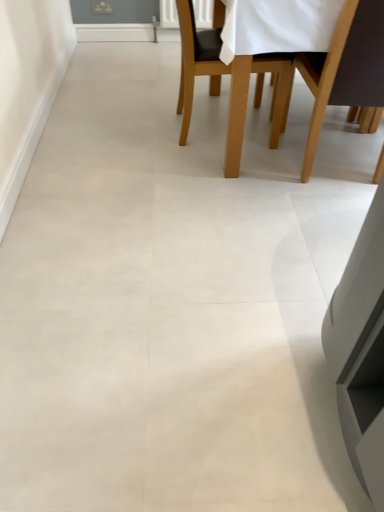
Question: Which direction should I rotate to face light brown wooden chair at upper center, acting as the 2th chair starting from the right, — up or down?

Choices:
 (A) down
 (B) up

Answer: (B)

Question: Does light brown wooden chair at upper center, acting as the 2th chair starting from the right, have a lesser height compared to brown wood chair at upper right, acting as the second chair starting from the left?

Choices:
 (A) yes
 (B) no

Answer: (A)

Question: Can you confirm if light brown wooden chair at upper center, which appears as the 1th chair when viewed from the left, is positioned to the left of brown wood chair at upper right, the first chair positioned from the right?

Choices:
 (A) no
 (B) yes

Answer: (B)

Question: From the image's perspective, does light brown wooden chair at upper center, acting as the 2th chair starting from the right, appear higher than brown wood chair at upper right, acting as the second chair starting from the left?

Choices:
 (A) no
 (B) yes

Answer: (B)

Question: Can you confirm if light brown wooden chair at upper center, acting as the 2th chair starting from the right, is bigger than brown wood chair at upper right, acting as the second chair starting from the left?

Choices:
 (A) yes
 (B) no

Answer: (A)

Question: Considering the relative sizes of light brown wooden chair at upper center, acting as the 2th chair starting from the right, and brown wood chair at upper right, the first chair positioned from the right, in the image provided, is light brown wooden chair at upper center, acting as the 2th chair starting from the right, wider than brown wood chair at upper right, the first chair positioned from the right,?

Choices:
 (A) no
 (B) yes

Answer: (B)

Question: Is light brown wooden chair at upper center, which appears as the 1th chair when viewed from the left, in contact with brown wood chair at upper right, the first chair positioned from the right?

Choices:
 (A) no
 (B) yes

Answer: (A)

Question: Is the depth of brown wood chair at upper right, acting as the second chair starting from the left, greater than that of light brown wooden chair at upper center, which appears as the 1th chair when viewed from the left?

Choices:
 (A) no
 (B) yes

Answer: (A)

Question: Are brown wood chair at upper right, the first chair positioned from the right, and light brown wooden chair at upper center, acting as the 2th chair starting from the right, located far from each other?

Choices:
 (A) no
 (B) yes

Answer: (A)

Question: Is brown wood chair at upper right, the first chair positioned from the right, thinner than light brown wooden chair at upper center, acting as the 2th chair starting from the right?

Choices:
 (A) no
 (B) yes

Answer: (B)

Question: Is brown wood chair at upper right, the first chair positioned from the right, at the left side of light brown wooden chair at upper center, which appears as the 1th chair when viewed from the left?

Choices:
 (A) yes
 (B) no

Answer: (B)

Question: Considering the relative sizes of brown wood chair at upper right, acting as the second chair starting from the left, and light brown wooden chair at upper center, which appears as the 1th chair when viewed from the left, in the image provided, is brown wood chair at upper right, acting as the second chair starting from the left, smaller than light brown wooden chair at upper center, which appears as the 1th chair when viewed from the left,?

Choices:
 (A) no
 (B) yes

Answer: (B)

Question: Does brown wood chair at upper right, acting as the second chair starting from the left, have a greater height compared to light brown wooden chair at upper center, acting as the 2th chair starting from the right?

Choices:
 (A) no
 (B) yes

Answer: (B)

Question: Looking at the image, does brown wood chair at upper right, the first chair positioned from the right, seem bigger or smaller compared to light brown wooden chair at upper center, which appears as the 1th chair when viewed from the left?

Choices:
 (A) big
 (B) small

Answer: (B)